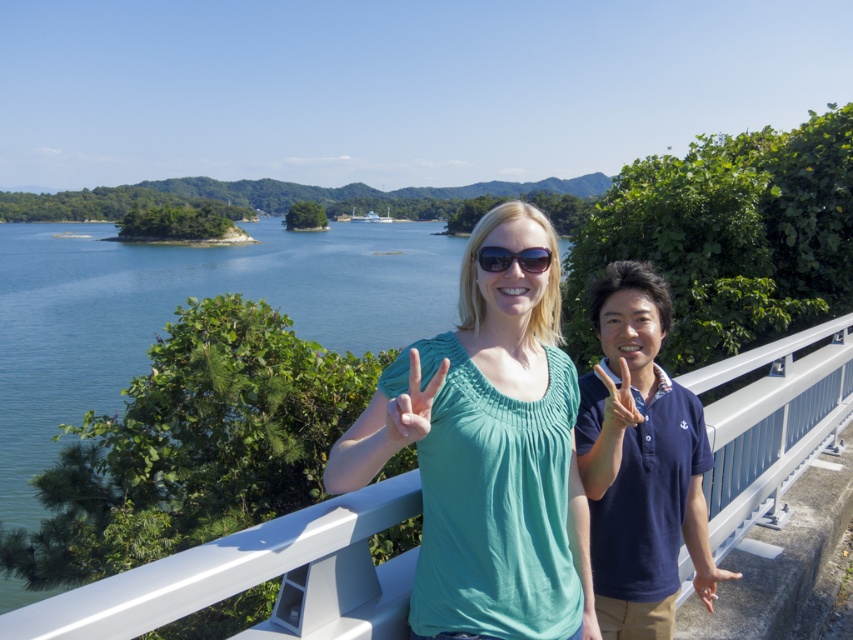
Does green fabric hand at center have a lesser height compared to sunglasses at center?

No, green fabric hand at center is not shorter than sunglasses at center.

Does green fabric hand at center have a greater height compared to sunglasses at center?

Correct, green fabric hand at center is much taller as sunglasses at center.

Which is in front, point (386, 412) or point (491, 253)?

Point (386, 412) is more forward.

Locate an element on the screen. green fabric hand at center is located at coordinates (412, 404).

Is teal fabric shirt at center to the left of green fabric hand at center from the viewer's perspective?

Incorrect, teal fabric shirt at center is not on the left side of green fabric hand at center.

Which of these two, teal fabric shirt at center or green fabric hand at center, stands shorter?

Standing shorter between the two is green fabric hand at center.

Is point (532, 518) positioned in front of point (399, 444)?

No, (532, 518) is further to viewer.

Identify the location of teal fabric shirt at center. (488, 452).

Does teal fabric shirt at center appear over smooth skin hand at center?

Yes, teal fabric shirt at center is above smooth skin hand at center.

Does point (486, 312) lie behind point (711, 560)?

No, (486, 312) is closer to viewer.

Which is behind, point (372, 397) or point (704, 595)?

The point (704, 595) is behind.

Where is `teal fabric shirt at center`? This screenshot has height=640, width=853. teal fabric shirt at center is located at coordinates (488, 452).